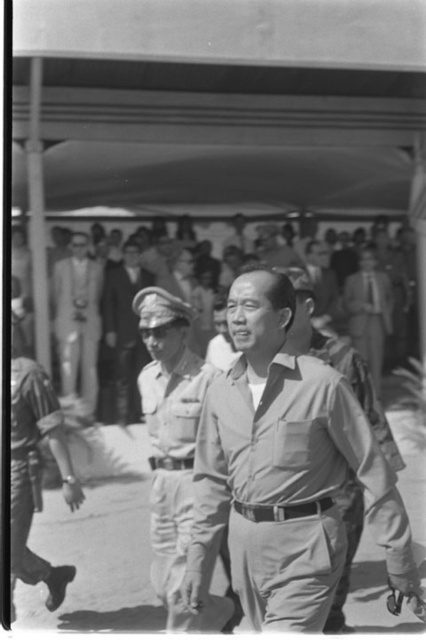
Question: Which point appears farthest from the camera in this image?

Choices:
 (A) [92, 296]
 (B) [98, 294]
 (C) [302, 404]
 (D) [169, 541]

Answer: (B)

Question: Considering the relative positions of matte khaki pants at center and light gray uniform at center in the image provided, where is matte khaki pants at center located with respect to light gray uniform at center?

Choices:
 (A) left
 (B) right

Answer: (B)

Question: Can you confirm if khaki uniform at center is wider than light beige uniform at center?

Choices:
 (A) no
 (B) yes

Answer: (A)

Question: Is khaki uniform at center further to the viewer compared to light beige uniform at center?

Choices:
 (A) no
 (B) yes

Answer: (A)

Question: Which object is closer to the camera taking this photo?

Choices:
 (A) khaki uniform at center
 (B) matte khaki pants at center
 (C) light gray uniform at center

Answer: (B)

Question: Which point is farther to the camera?

Choices:
 (A) matte khaki pants at center
 (B) smooth beige suit at center

Answer: (B)